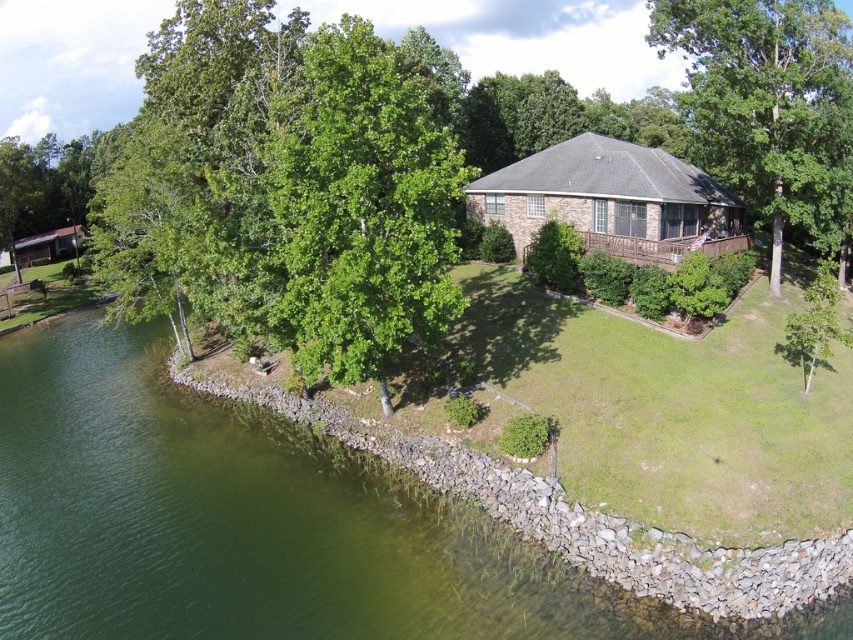
You are a drone operator flying a drone over a lakeside property. You need to ensure the drone stays above the green water at lower left. What coordinates should you aim for to keep the drone above that specific area?

The coordinates to aim for are point (258, 524) to keep the drone above the green water at lower left.

You are planning to build a small boat dock on the water near the green water at lower left and the brown brick cottage at center. Considering their widths, which area would be more suitable for the dock?

The green water at lower left has a greater width than the brown brick cottage at center, making it more suitable for building the dock.

You are standing at the wooden deck extending from the house and looking towards the water. You notice two points marked in the image. Which point, point (38, 419) or point (78, 244), is closer to your current position?

Point (38, 419) is closer to the camera than point (78, 244), so it is closer to your current position.